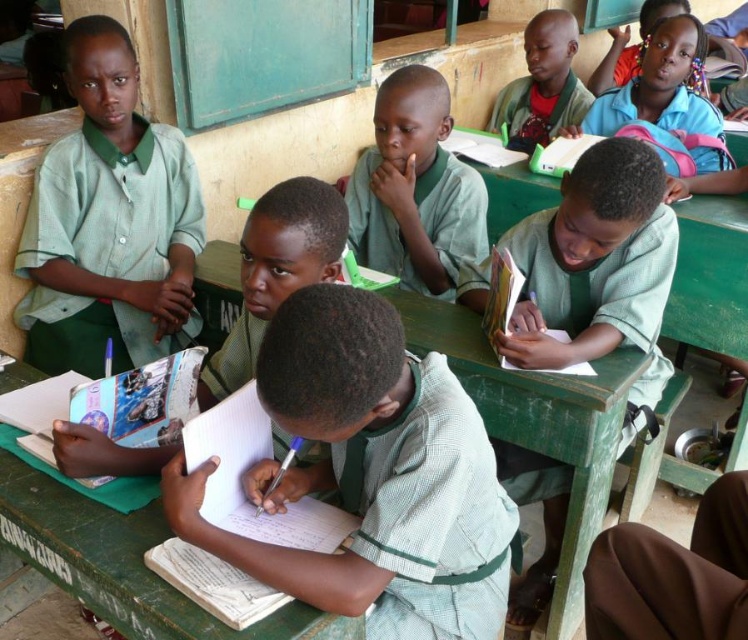
Question: Is green striped shirt at center wider than green fabric shirt at center?

Choices:
 (A) no
 (B) yes

Answer: (B)

Question: Does green fabric shirt at center have a smaller size compared to green wooden table at center?

Choices:
 (A) no
 (B) yes

Answer: (A)

Question: Which object is the farthest from the green wooden table at center?

Choices:
 (A) matte green uniform at center
 (B) green matte uniform at center

Answer: (A)

Question: Estimate the real-world distances between objects in this image. Which object is farther from the green wooden table at center?

Choices:
 (A) green striped shirt at center
 (B) green fabric shirt at upper left
 (C) green fabric shirt at center
 (D) green matte uniform at center

Answer: (D)

Question: Is the position of green wooden table at center more distant than that of green matte uniform at center?

Choices:
 (A) no
 (B) yes

Answer: (A)

Question: Which object is closer to the camera taking this photo?

Choices:
 (A) green wooden table at center
 (B) green striped shirt at center
 (C) green matte uniform at center

Answer: (B)